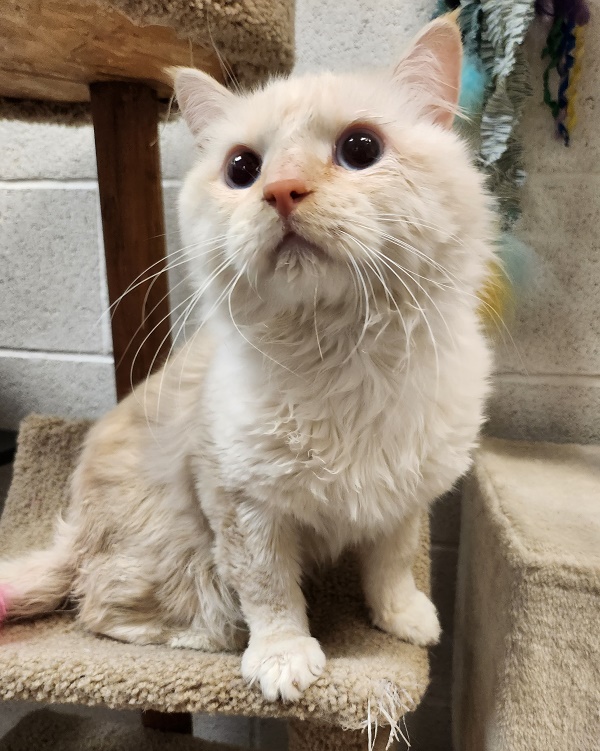
I want to click on wall, so click(x=582, y=219), click(x=63, y=231).